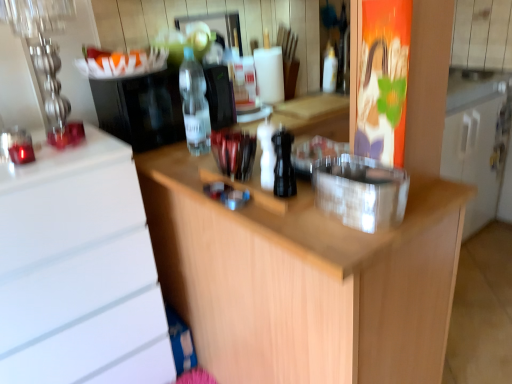
Where is `free space in front of transparent plastic container at center, which is counted as the first appliance, starting from the bottom`? The height and width of the screenshot is (384, 512). free space in front of transparent plastic container at center, which is counted as the first appliance, starting from the bottom is located at coordinates (348, 235).